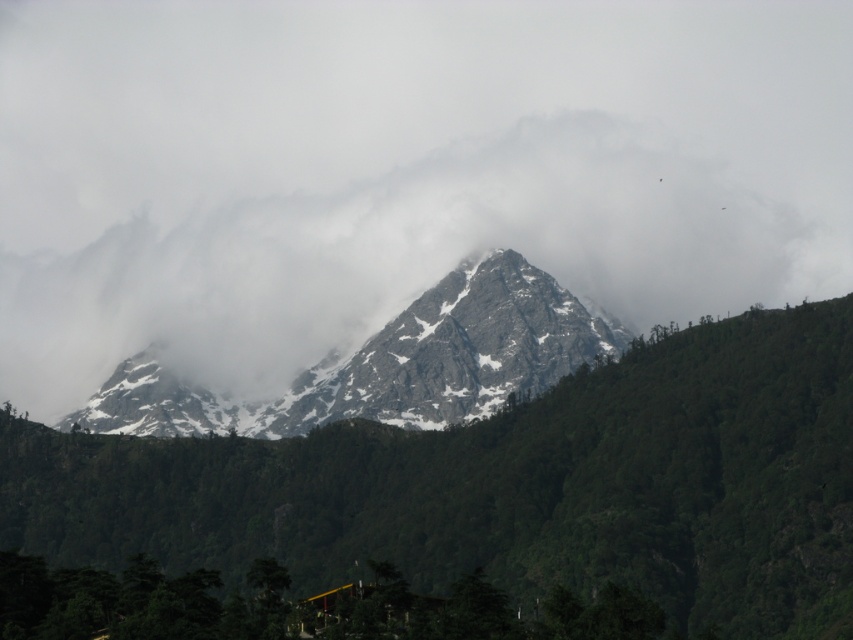
Question: Which object is farther from the camera taking this photo?

Choices:
 (A) snowy rocky mountain at center
 (B) white fluffy cloud at center

Answer: (A)

Question: Is snowy rocky mountain at center to the left of white fluffy cloud at center from the viewer's perspective?

Choices:
 (A) yes
 (B) no

Answer: (B)

Question: Can you confirm if snowy rocky mountain at center is bigger than white fluffy cloud at center?

Choices:
 (A) no
 (B) yes

Answer: (A)

Question: Which object is closer to the camera taking this photo?

Choices:
 (A) snowy granite peak at center
 (B) white fluffy cloud at center
 (C) snowy rocky mountain at center

Answer: (A)

Question: Does snowy rocky mountain at center appear under snowy granite peak at center?

Choices:
 (A) no
 (B) yes

Answer: (B)

Question: Among these objects, which one is nearest to the camera?

Choices:
 (A) white fluffy cloud at center
 (B) snowy rocky mountain at center

Answer: (A)